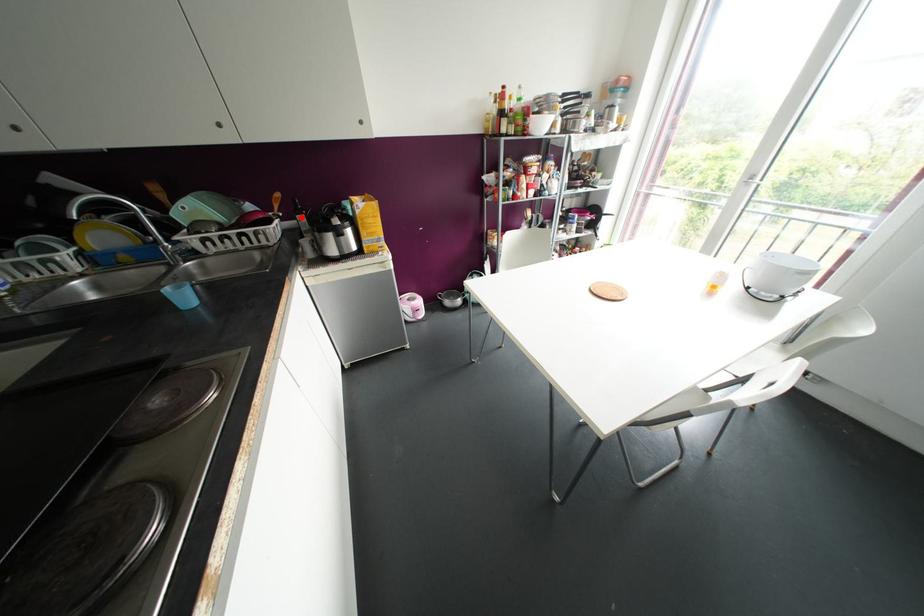
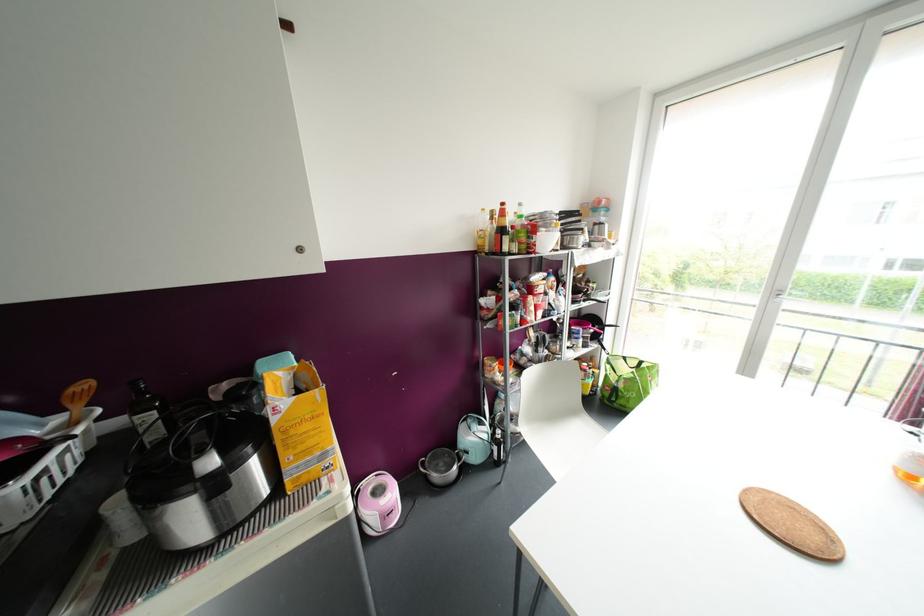
In the second image, find the point that corresponds to the highlighted location in the first image.

(150, 416)